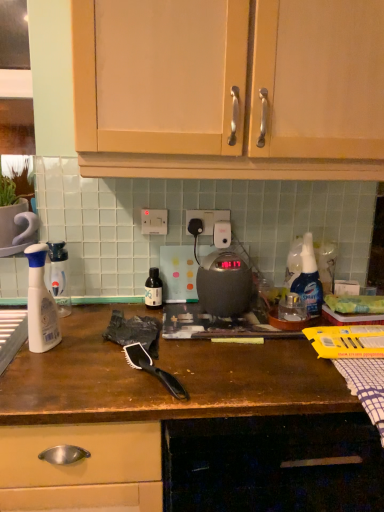
The image size is (384, 512). Describe the element at coordinates (153, 289) in the screenshot. I see `matte black bottle at center, which is counted as the 2th bottle, starting from the left` at that location.

Image resolution: width=384 pixels, height=512 pixels. What do you see at coordinates (309, 279) in the screenshot?
I see `translucent plastic spray bottle at right` at bounding box center [309, 279].

You are a GUI agent. You are given a task and a screenshot of the screen. Output one action in this format:
    pyautogui.click(x=<x>, y=<y>)
    Task: Click on the translucent plastic spray bottle at left
    Image resolution: width=384 pixels, height=512 pixels.
    Given the screenshot: What is the action you would take?
    pos(40,304)

Locate an element on the screen. Image resolution: width=384 pixels, height=512 pixels. white plastic electric outlet at center, the first electric outlet when ordered from right to left is located at coordinates (207, 219).

From the image's perspective, is matte wood cabinets at upper center, which is the 1th cabinetry in top-to-bottom order, above matte black kettle at center?

Yes.

Considering the relative sizes of matte wood cabinets at upper center, which is the 1th cabinetry in top-to-bottom order, and matte black kettle at center in the image provided, is matte wood cabinets at upper center, which is the 1th cabinetry in top-to-bottom order, wider than matte black kettle at center?

Indeed, matte wood cabinets at upper center, which is the 1th cabinetry in top-to-bottom order, has a greater width compared to matte black kettle at center.

From the picture: Does matte wood cabinets at upper center, which is counted as the 2th cabinetry, starting from the bottom, appear on the right side of matte black kettle at center?

Yes, matte wood cabinets at upper center, which is counted as the 2th cabinetry, starting from the bottom, is to the right of matte black kettle at center.

Considering the positions of point (60, 505) and point (197, 218), is point (60, 505) closer or farther from the camera than point (197, 218)?

Point (60, 505) is positioned closer to the camera compared to point (197, 218).

Is brown matte countertop at center, which appears as the second cabinetry when viewed from the top, taller than white plastic electric outlet at center, arranged as the 2th electric outlet when viewed from the left?

Correct, brown matte countertop at center, which appears as the second cabinetry when viewed from the top, is much taller as white plastic electric outlet at center, arranged as the 2th electric outlet when viewed from the left.

Find the location of a particular element. This screenshot has height=512, width=384. cabinetry that is the 2nd object located in front of the white plastic electric outlet at center, arranged as the 2th electric outlet when viewed from the left is located at coordinates (182, 425).

Is brown matte countertop at center, which appears as the second cabinetry when viewed from the top, looking in the opposite direction of white plastic electric outlet at center, arranged as the 2th electric outlet when viewed from the left?

brown matte countertop at center, which appears as the second cabinetry when viewed from the top, is not turned away from white plastic electric outlet at center, arranged as the 2th electric outlet when viewed from the left.

How distant is translucent plastic spray bottle at left from translucent plastic spray bottle at right?

They are 74.18 centimeters apart.

Is the surface of translucent plastic spray bottle at left in direct contact with translucent plastic spray bottle at right?

→ translucent plastic spray bottle at left is not next to translucent plastic spray bottle at right, and they're not touching.

Find the location of a particular element. This screenshot has width=384, height=512. cleaning product above the translucent plastic spray bottle at left (from the image's perspective) is located at coordinates pos(309,279).

From a real-world perspective, is translucent plastic spray bottle at left below translucent plastic spray bottle at right?

Correct, in the physical world, translucent plastic spray bottle at left is lower than translucent plastic spray bottle at right.

From the image's perspective, is white plastic electric outlet at center, the 2th electric outlet viewed from the right, beneath white plastic spray bottle at left, which is the second bottle in right-to-left order?

No, from the image's perspective, white plastic electric outlet at center, the 2th electric outlet viewed from the right, is not below white plastic spray bottle at left, which is the second bottle in right-to-left order.

Is white plastic electric outlet at center, which is the 1th electric outlet from left to right, with white plastic spray bottle at left, which is the second bottle in right-to-left order?

No.

Is white plastic electric outlet at center, the 2th electric outlet viewed from the right, positioned with its back to white plastic spray bottle at left, which is the second bottle in right-to-left order?

white plastic electric outlet at center, the 2th electric outlet viewed from the right, is not turned away from white plastic spray bottle at left, which is the second bottle in right-to-left order.

Is white plastic electric outlet at center, the 2th electric outlet viewed from the right, behind white plastic spray bottle at left, marked as the first bottle in a left-to-right arrangement?

Yes, white plastic electric outlet at center, the 2th electric outlet viewed from the right, is further from the viewer.

Is white plastic electric outlet at center, which is the 1th electric outlet from left to right, looking in the opposite direction of brown matte countertop at center, which appears as the second cabinetry when viewed from the top?

No, white plastic electric outlet at center, which is the 1th electric outlet from left to right, is not facing the opposite direction of brown matte countertop at center, which appears as the second cabinetry when viewed from the top.

Which of these two, white plastic electric outlet at center, the 2th electric outlet viewed from the right, or brown matte countertop at center, which appears as the second cabinetry when viewed from the top, is bigger?

brown matte countertop at center, which appears as the second cabinetry when viewed from the top, is bigger.

Is point (151, 224) closer or farther from the camera than point (93, 500)?

Point (151, 224) appears to be farther away from the viewer than point (93, 500).

Considering the relative sizes of white plastic electric outlet at center, which is the 1th electric outlet from left to right, and brown matte countertop at center, which appears as the second cabinetry when viewed from the top, in the image provided, is white plastic electric outlet at center, which is the 1th electric outlet from left to right, shorter than brown matte countertop at center, which appears as the second cabinetry when viewed from the top,?

Correct, white plastic electric outlet at center, which is the 1th electric outlet from left to right, is not as tall as brown matte countertop at center, which appears as the second cabinetry when viewed from the top.

In the image, is brown matte countertop at center, which appears as the second cabinetry when viewed from the top, on the left side or the right side of white plastic electric outlet at center, the 2th electric outlet viewed from the right?

brown matte countertop at center, which appears as the second cabinetry when viewed from the top, is positioned on white plastic electric outlet at center, the 2th electric outlet viewed from the right,'s right side.

Looking at this image, can you confirm if brown matte countertop at center, which appears as the second cabinetry when viewed from the top, is wider than white plastic electric outlet at center, the 2th electric outlet viewed from the right?

Yes.

Image resolution: width=384 pixels, height=512 pixels. I want to click on electric outlet that is the 1st one when counting backward from the brown matte countertop at center, which appears as the second cabinetry when viewed from the top, so click(x=154, y=221).

Which is in front, brown matte countertop at center, which appears as the second cabinetry when viewed from the top, or white plastic electric outlet at center, the 2th electric outlet viewed from the right?

brown matte countertop at center, which appears as the second cabinetry when viewed from the top, is in front.

Which of these two, white plastic electric outlet at center, the 2th electric outlet viewed from the right, or matte wood cabinets at upper center, which is counted as the 2th cabinetry, starting from the bottom, is smaller?

Smaller between the two is white plastic electric outlet at center, the 2th electric outlet viewed from the right.

Is white plastic electric outlet at center, the 2th electric outlet viewed from the right, far away from matte wood cabinets at upper center, which is the 1th cabinetry in top-to-bottom order?

Actually, white plastic electric outlet at center, the 2th electric outlet viewed from the right, and matte wood cabinets at upper center, which is the 1th cabinetry in top-to-bottom order, are a little close together.

From a real-world perspective, who is located higher, white plastic electric outlet at center, which is the 1th electric outlet from left to right, or matte wood cabinets at upper center, which is the 1th cabinetry in top-to-bottom order?

In real-world perspective, matte wood cabinets at upper center, which is the 1th cabinetry in top-to-bottom order, is above.

In the image, is white plastic electric outlet at center, which is the 1th electric outlet from left to right, on the left side or the right side of matte wood cabinets at upper center, which is the 1th cabinetry in top-to-bottom order?

white plastic electric outlet at center, which is the 1th electric outlet from left to right, is to the left of matte wood cabinets at upper center, which is the 1th cabinetry in top-to-bottom order.

Locate an element on the screen. The width and height of the screenshot is (384, 512). the 1st cabinetry in front of the matte black kettle at center is located at coordinates (x=228, y=88).

The height and width of the screenshot is (512, 384). I want to click on electric outlet that is the 2nd object above the brown matte countertop at center, which appears as the second cabinetry when viewed from the top (from a real-world perspective), so click(207, 219).

Which object lies further to the anchor point brown matte countertop at center, the 1th cabinetry ordered from the bottom, translucent plastic spray bottle at right or translucent plastic spray bottle at left?

The object further to brown matte countertop at center, the 1th cabinetry ordered from the bottom, is translucent plastic spray bottle at right.

Estimate the real-world distances between objects in this image. Which object is closer to white plastic spray bottle at left, which is the second bottle in right-to-left order, translucent plastic spray bottle at left or matte black bottle at center, which ranks as the 1th bottle in right-to-left order?

translucent plastic spray bottle at left is positioned closer to the anchor white plastic spray bottle at left, which is the second bottle in right-to-left order.

Considering their positions, is matte black kettle at center positioned closer to white plastic electric outlet at center, arranged as the 2th electric outlet when viewed from the left, than translucent plastic spray bottle at right?

matte black kettle at center is closer to white plastic electric outlet at center, arranged as the 2th electric outlet when viewed from the left.

From the image, which object appears to be farther from matte black bottle at center, which ranks as the 1th bottle in right-to-left order, white plastic spray bottle at left, which is the second bottle in right-to-left order, or translucent plastic spray bottle at left?

translucent plastic spray bottle at left.

When comparing their distances from white plastic spray bottle at left, which is the second bottle in right-to-left order, does matte wood cabinets at upper center, which is the 1th cabinetry in top-to-bottom order, or brown matte countertop at center, the 1th cabinetry ordered from the bottom, seem further?

matte wood cabinets at upper center, which is the 1th cabinetry in top-to-bottom order, lies further to white plastic spray bottle at left, which is the second bottle in right-to-left order, than the other object.

Estimate the real-world distances between objects in this image. Which object is further from white plastic spray bottle at left, marked as the first bottle in a left-to-right arrangement, white plastic electric outlet at center, arranged as the 2th electric outlet when viewed from the left, or white plastic electric outlet at center, the 2th electric outlet viewed from the right?

Among the two, white plastic electric outlet at center, arranged as the 2th electric outlet when viewed from the left, is located further to white plastic spray bottle at left, marked as the first bottle in a left-to-right arrangement.

When comparing their distances from white plastic spray bottle at left, marked as the first bottle in a left-to-right arrangement, does matte black kettle at center or matte black bottle at center, which ranks as the 1th bottle in right-to-left order, seem closer?

Based on the image, matte black bottle at center, which ranks as the 1th bottle in right-to-left order, appears to be nearer to white plastic spray bottle at left, marked as the first bottle in a left-to-right arrangement.

Considering their positions, is matte black kettle at center positioned closer to brown matte countertop at center, which appears as the second cabinetry when viewed from the top, than white plastic electric outlet at center, which is the 1th electric outlet from left to right?

Based on the image, matte black kettle at center appears to be nearer to brown matte countertop at center, which appears as the second cabinetry when viewed from the top.

The width and height of the screenshot is (384, 512). In order to click on bottle between white plastic spray bottle at left, marked as the first bottle in a left-to-right arrangement, and white plastic electric outlet at center, the 2th electric outlet viewed from the right in this screenshot , I will do `click(153, 289)`.

Image resolution: width=384 pixels, height=512 pixels. Identify the location of bottle between white plastic spray bottle at left, which is the second bottle in right-to-left order, and translucent plastic spray bottle at right. (153, 289).

Find the location of `home appliance situated between white plastic spray bottle at left, marked as the first bottle in a left-to-right arrangement, and translucent plastic spray bottle at right from left to right`. home appliance situated between white plastic spray bottle at left, marked as the first bottle in a left-to-right arrangement, and translucent plastic spray bottle at right from left to right is located at coordinates (224, 284).

Where is `bottle situated between white plastic spray bottle at left, which is the second bottle in right-to-left order, and matte black kettle at center from left to right`? bottle situated between white plastic spray bottle at left, which is the second bottle in right-to-left order, and matte black kettle at center from left to right is located at coordinates (153, 289).